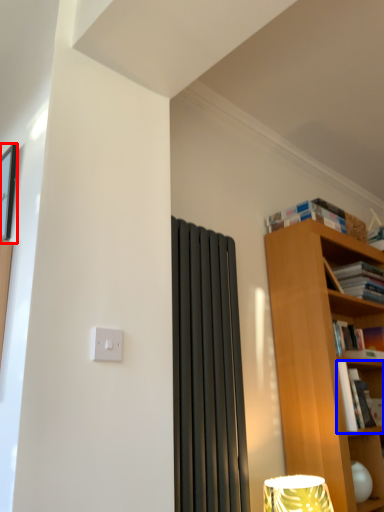
Question: Which point is closer to the camera, picture frame (highlighted by a red box) or book (highlighted by a blue box)?

Choices:
 (A) picture frame
 (B) book

Answer: (A)